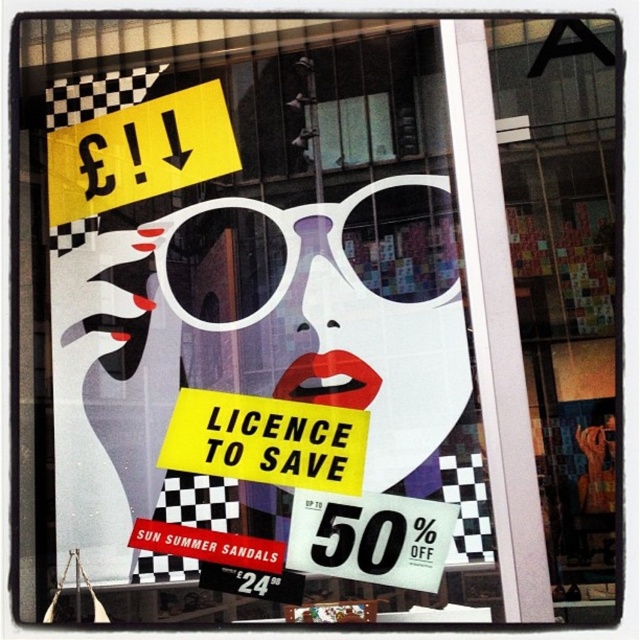
You are standing in front of the storefront window advertisement. The checkerboard glass at upper right is part of the display. Can you determine its exact position using the coordinate system provided?

The checkerboard glass at upper right is located at point (564, 285), so its exact position is at those coordinates.

From the picture: You are designing a new advertisement and want to place a decorative sticker on the narrower object between the checkerboard glass at upper right and the yellow paper at upper left. Which object should you choose?

The checkerboard glass at upper right has a lesser width compared to yellow paper at upper left, so you should place the decorative sticker on the checkerboard glass at upper right.

You are standing 1.68 meters away from the storefront window. There is a point marked at coordinates point (x=554, y=499) on the window. If you want to touch this point directly, where should you aim your hand relative to the woman in the advertisement?

The point (x=554, y=499) is located 1.68 meters away from you. To touch it directly, aim your hand at the point (x=554, y=499) on the window, which is positioned near the woman in the advertisement.